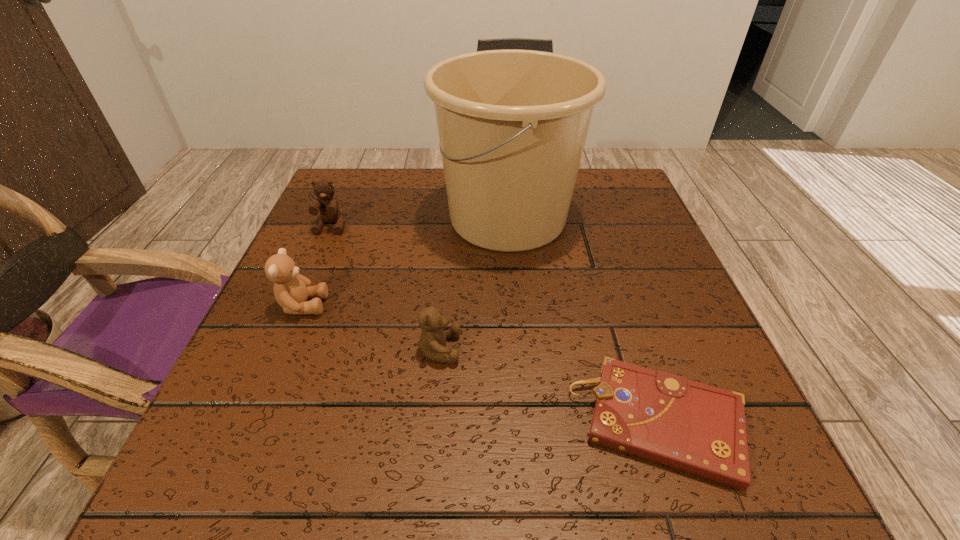
Where is `blank region between the third farthest object and the tallest object`? The height and width of the screenshot is (540, 960). blank region between the third farthest object and the tallest object is located at coordinates (405, 262).

Where is `vacant area that lies between the rightmost teddy bear and the bucket`? The image size is (960, 540). vacant area that lies between the rightmost teddy bear and the bucket is located at coordinates (473, 284).

Where is `free space between the tallest object and the rightmost teddy bear`? This screenshot has width=960, height=540. free space between the tallest object and the rightmost teddy bear is located at coordinates coord(473,284).

You are a GUI agent. You are given a task and a screenshot of the screen. Output one action in this format:
    pyautogui.click(x=<x>, y=<y>)
    Task: Click on the blank region between the third nearest object and the notebook
    
    Given the screenshot: What is the action you would take?
    pyautogui.click(x=481, y=364)

In order to click on free space between the rightmost teddy bear and the notebook in this screenshot , I will do tap(549, 386).

Identify which object is the closest to the third farthest object. Please provide its 2D coordinates. Your answer should be formatted as a tuple, i.e. [(x, y)], where the tuple contains the x and y coordinates of a point satisfying the conditions above.

[(329, 212)]

Locate which object is the fourth closest to the farthest teddy bear. Please provide its 2D coordinates. Your answer should be formatted as a tuple, i.e. [(x, y)], where the tuple contains the x and y coordinates of a point satisfying the conditions above.

[(697, 428)]

Locate an element on the screen. The width and height of the screenshot is (960, 540). teddy bear that is the second nearest to the shortest object is located at coordinates (291, 289).

Locate which teddy bear ranks third in proximity to the bucket. Please provide its 2D coordinates. Your answer should be formatted as a tuple, i.e. [(x, y)], where the tuple contains the x and y coordinates of a point satisfying the conditions above.

[(329, 212)]

Identify the location of vacant space that satisfies the following two spatial constraints: 1. on the face of the shortest object; 2. on the left side of the third farthest object. (254, 422).